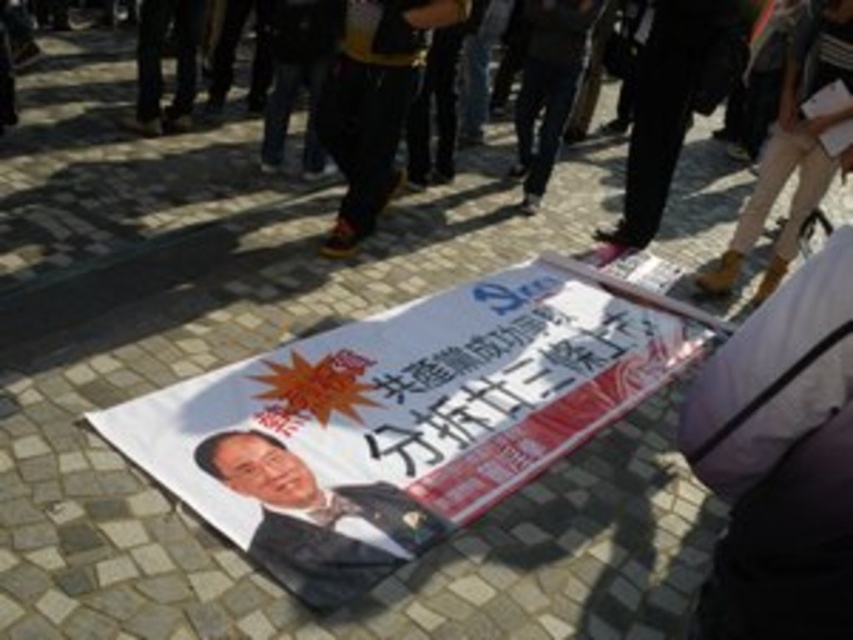
You are a photographer standing at the edge of the paved area. You want to take a photo of the white paper poster at center without including any of the people in the background. Since you are 1.70 meters tall, can you crouch down enough to avoid capturing the people behind the poster?

The white paper poster at center is 2.60 meters away from the viewer. Since the photographer is 1.70 meters tall, crouching would lower their viewpoint enough to potentially avoid capturing the people behind the poster, as the distance allows for positioning that blocks the background individuals with the poster itself.

Looking at this image, you are a photographer standing behind the banner and want to take a photo that includes both the dark clothing at center and the smooth black suit at center. Which object should you adjust your focus to ensure both are in the frame?

The dark clothing at center is closer to you than the smooth black suit at center. To ensure both are in focus, adjust your camera settings to a smaller aperture for a deeper depth of field so both the dark clothing at center and the smooth black suit at center are sharp.